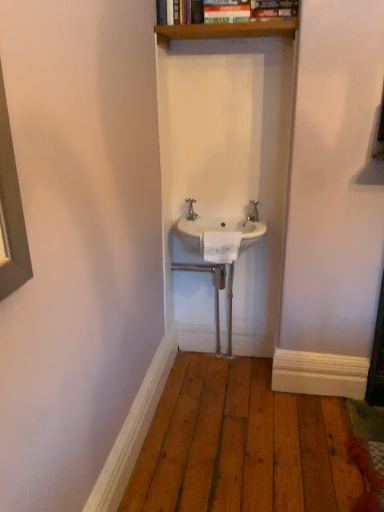
Question: Could you tell me if white plastic towel bar at center is facing white ceramic sink at center?

Choices:
 (A) no
 (B) yes

Answer: (A)

Question: From the image's perspective, would you say white plastic towel bar at center is shown under white ceramic sink at center?

Choices:
 (A) yes
 (B) no

Answer: (A)

Question: Does white plastic towel bar at center appear on the left side of white ceramic sink at center?

Choices:
 (A) no
 (B) yes

Answer: (B)

Question: Considering the relative sizes of white plastic towel bar at center and white ceramic sink at center in the image provided, is white plastic towel bar at center bigger than white ceramic sink at center?

Choices:
 (A) yes
 (B) no

Answer: (B)

Question: Considering the relative sizes of white plastic towel bar at center and white ceramic sink at center in the image provided, is white plastic towel bar at center taller than white ceramic sink at center?

Choices:
 (A) yes
 (B) no

Answer: (A)

Question: Is white plastic towel bar at center taller or shorter than white ceramic sink at center?

Choices:
 (A) tall
 (B) short

Answer: (A)

Question: In the image, is white plastic towel bar at center on the left side or the right side of white ceramic sink at center?

Choices:
 (A) left
 (B) right

Answer: (A)

Question: From a real-world perspective, is white plastic towel bar at center above or below white ceramic sink at center?

Choices:
 (A) below
 (B) above

Answer: (A)

Question: From the image's perspective, is white plastic towel bar at center located above or below white ceramic sink at center?

Choices:
 (A) below
 (B) above

Answer: (A)

Question: In the image, is white plastic towel bar at center on the left side or the right side of silver metallic tap at center?

Choices:
 (A) right
 (B) left

Answer: (A)

Question: In terms of width, does white plastic towel bar at center look wider or thinner when compared to silver metallic tap at center?

Choices:
 (A) wide
 (B) thin

Answer: (A)

Question: Does point (206, 244) appear closer or farther from the camera than point (190, 217)?

Choices:
 (A) closer
 (B) farther

Answer: (A)

Question: Is white plastic towel bar at center in front of or behind silver metallic tap at center in the image?

Choices:
 (A) front
 (B) behind

Answer: (A)

Question: Which is correct: white ceramic sink at center is inside wooden shelf at upper center, or outside of it?

Choices:
 (A) inside
 (B) outside

Answer: (B)

Question: Is white ceramic sink at center taller or shorter than wooden shelf at upper center?

Choices:
 (A) short
 (B) tall

Answer: (B)